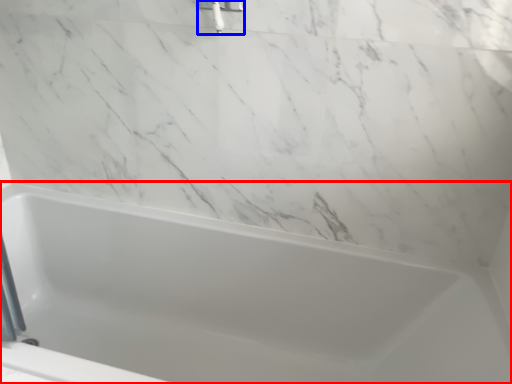
Question: Which object is further to the camera taking this photo, bathtub (highlighted by a red box) or shower (highlighted by a blue box)?

Choices:
 (A) bathtub
 (B) shower

Answer: (B)